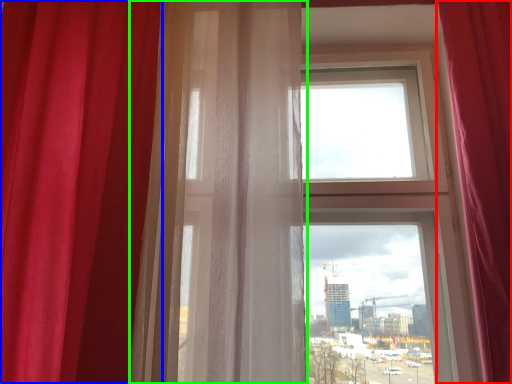
Question: Which object is the farthest from curtain (highlighted by a red box)? Choose among these: curtain (highlighted by a blue box) or curtain (highlighted by a green box).

Choices:
 (A) curtain
 (B) curtain

Answer: (A)